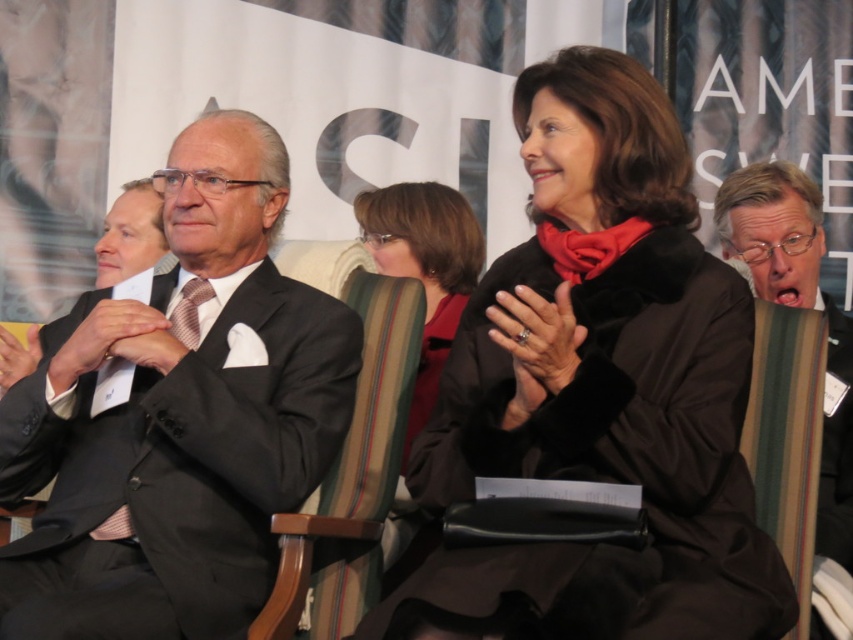
Question: Estimate the real-world distances between objects in this image. Which object is closer to the black leather jacket at right?

Choices:
 (A) silky brown tie at center
 (B) matte black suit at center
 (C) matte black suit at left

Answer: (C)

Question: Is matte black suit at left above matte black suit at center?

Choices:
 (A) no
 (B) yes

Answer: (A)

Question: Which point is farther to the camera?

Choices:
 (A) silky brown tie at center
 (B) black leather jacket at right
 (C) matte red coat at center
 (D) matte black suit at left

Answer: (C)

Question: Can you confirm if matte black suit at center is smaller than silky brown tie at center?

Choices:
 (A) no
 (B) yes

Answer: (A)

Question: Which object is farther from the camera taking this photo?

Choices:
 (A) velvet black coat at center
 (B) matte black suit at center
 (C) matte red coat at center

Answer: (B)

Question: Is matte black suit at left positioned before black leather jacket at right?

Choices:
 (A) no
 (B) yes

Answer: (B)